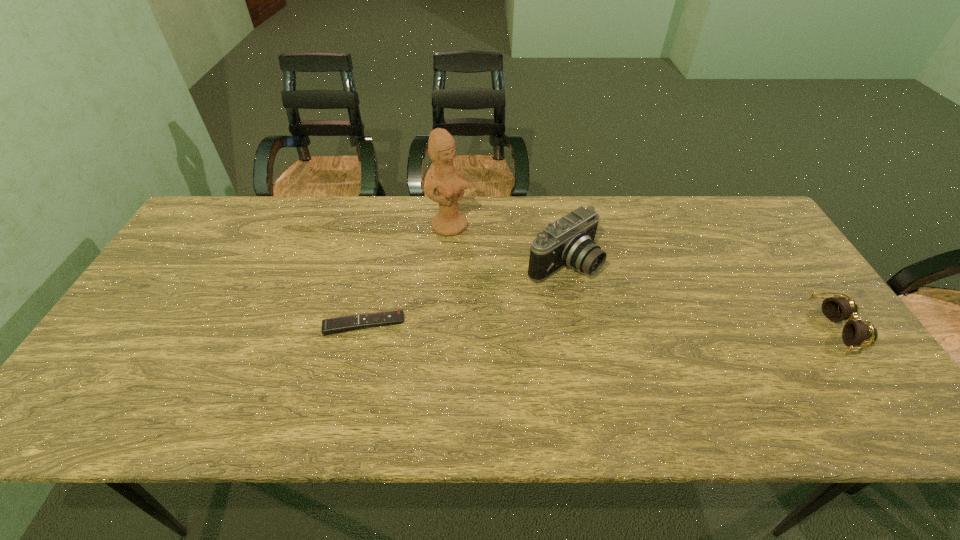
What are the coordinates of `free space on the desktop that is between the remote control and the third tallest object and is positioned on the front-facing side of the third object from right to left` in the screenshot? It's located at (577, 327).

You are a GUI agent. You are given a task and a screenshot of the screen. Output one action in this format:
    pyautogui.click(x=<x>, y=<y>)
    Task: Click on the vacant space on the desktop that is between the leftmost object and the second shortest object and is positioned on the front-facing side of the second farthest object
    
    Given the screenshot: What is the action you would take?
    pyautogui.click(x=653, y=327)